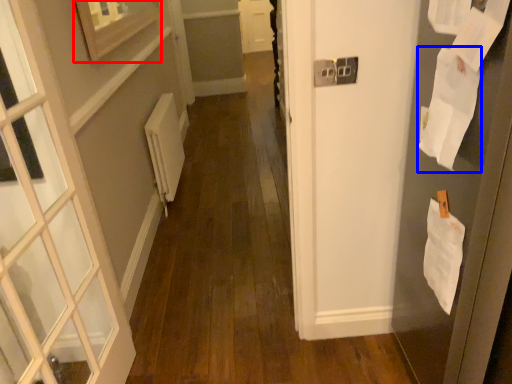
Question: Among these objects, which one is farthest to the camera, picture frame (highlighted by a red box) or paper (highlighted by a blue box)?

Choices:
 (A) picture frame
 (B) paper

Answer: (A)